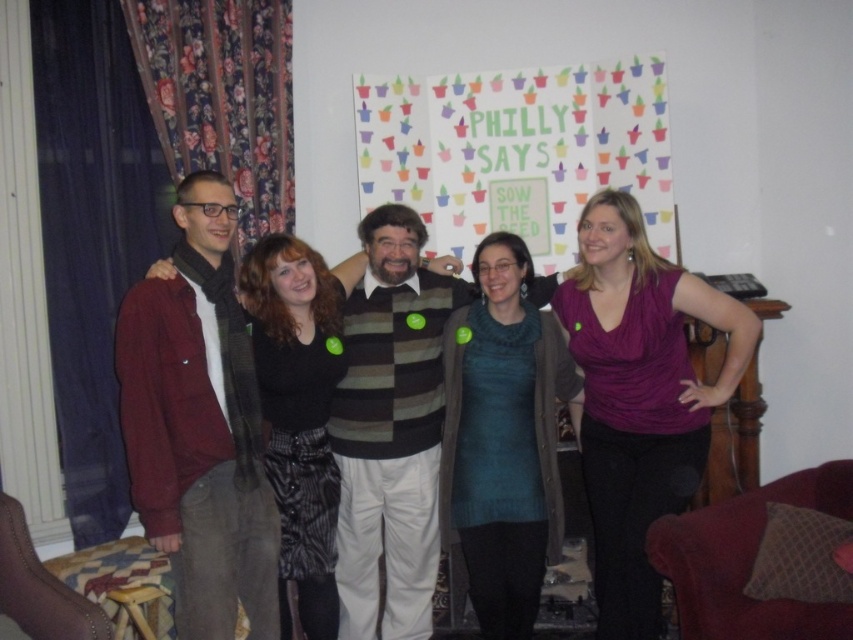
Is teal sweater at center behind matte black sweater at center?

Yes, teal sweater at center is further from the viewer.

Who is more forward, (x=506, y=476) or (x=254, y=282)?

Point (x=254, y=282) is more forward.

What do you see at coordinates (503, 438) in the screenshot? I see `teal sweater at center` at bounding box center [503, 438].

Locate an element on the screen. The height and width of the screenshot is (640, 853). teal sweater at center is located at coordinates (503, 438).

Can you confirm if multicolored paper poster at center is shorter than maroon cotton jacket at left?

Yes, multicolored paper poster at center is shorter than maroon cotton jacket at left.

Can you confirm if multicolored paper poster at center is wider than maroon cotton jacket at left?

Correct, the width of multicolored paper poster at center exceeds that of maroon cotton jacket at left.

Is point (537, 218) positioned before point (173, 609)?

No.

You are a GUI agent. You are given a task and a screenshot of the screen. Output one action in this format:
    pyautogui.click(x=<x>, y=<y>)
    Task: Click on the multicolored paper poster at center
    The width and height of the screenshot is (853, 640).
    Given the screenshot: What is the action you would take?
    pyautogui.click(x=518, y=150)

Who is positioned more to the right, maroon cotton jacket at left or teal sweater at center?

teal sweater at center is more to the right.

What do you see at coordinates (199, 426) in the screenshot? I see `maroon cotton jacket at left` at bounding box center [199, 426].

Is point (132, 413) in front of point (512, 538)?

Yes, point (132, 413) is closer to viewer.

At what (x,y) coordinates should I click in order to perform the action: click on maroon cotton jacket at left. Please return your answer as a coordinate pair (x, y). The image size is (853, 640). Looking at the image, I should click on pyautogui.click(x=199, y=426).